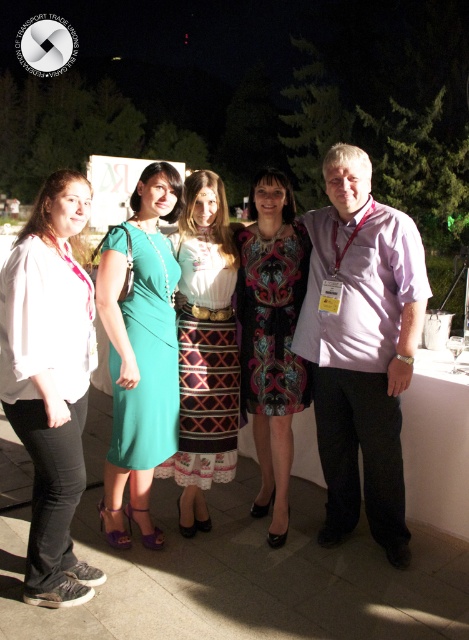
Question: Which object is positioned closest to the teal fabric dress at center?

Choices:
 (A) pink cotton shirt at center
 (B) matte white shirt at left
 (C) printed fabric dress at center
 (D) patterned fabric skirt at center

Answer: (D)

Question: Which of these objects is positioned farthest from the teal fabric dress at center?

Choices:
 (A) pink cotton shirt at center
 (B) patterned fabric skirt at center
 (C) printed fabric dress at center
 (D) matte white shirt at left

Answer: (A)

Question: Is pink cotton shirt at center above teal fabric dress at center?

Choices:
 (A) yes
 (B) no

Answer: (A)

Question: Which object is positioned closest to the matte white shirt at left?

Choices:
 (A) teal fabric dress at center
 (B) pink cotton shirt at center

Answer: (A)

Question: Does matte white shirt at left have a lesser width compared to teal fabric dress at center?

Choices:
 (A) yes
 (B) no

Answer: (A)

Question: Does patterned fabric skirt at center come behind printed fabric dress at center?

Choices:
 (A) yes
 (B) no

Answer: (A)